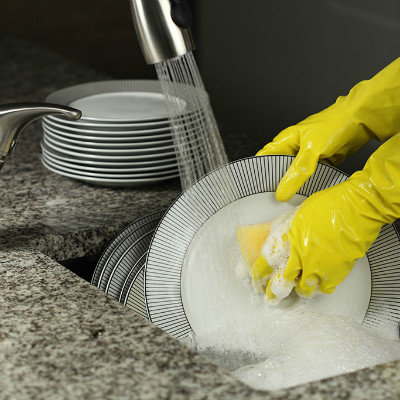
Where is `countertop`? The width and height of the screenshot is (400, 400). countertop is located at coordinates (68, 294).